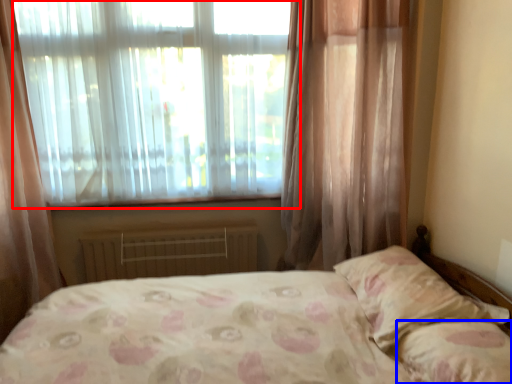
Question: Which object is further to the camera taking this photo, window (highlighted by a red box) or pillow (highlighted by a blue box)?

Choices:
 (A) window
 (B) pillow

Answer: (A)